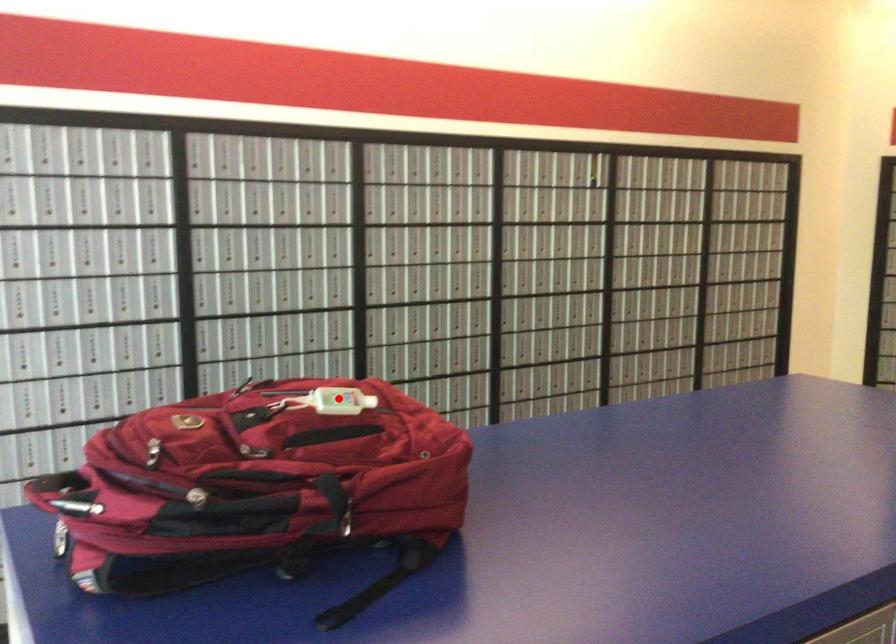
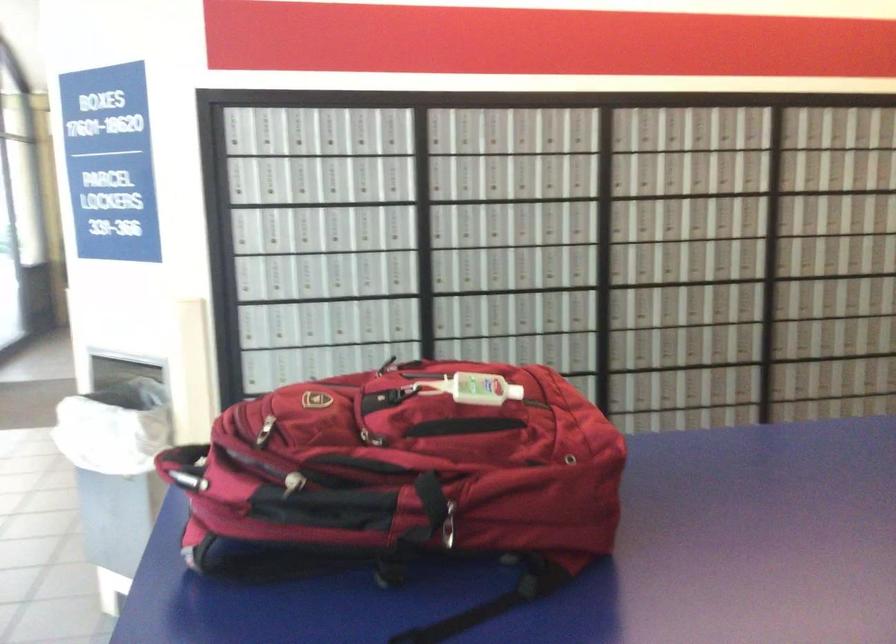
Find the pixel in the second image that matches the highlighted location in the first image.

(471, 389)